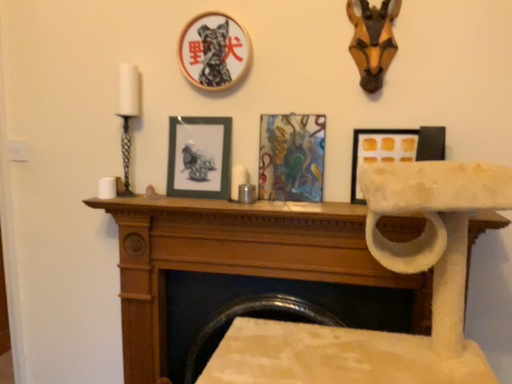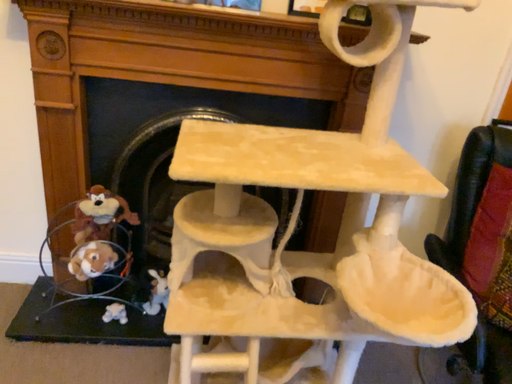
Question: Which way did the camera rotate in the video?

Choices:
 (A) rotated upward
 (B) rotated downward

Answer: (B)